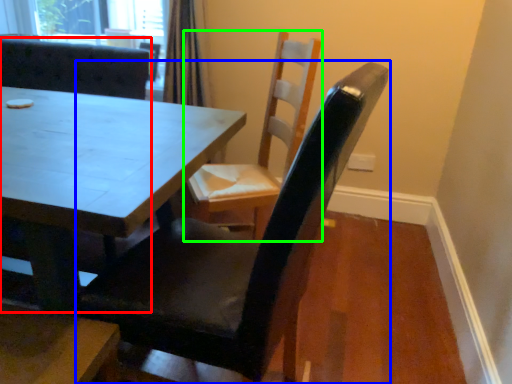
Question: Which object is the farthest from chair (highlighted by a red box)? Choose among these: chair (highlighted by a blue box) or chair (highlighted by a green box).

Choices:
 (A) chair
 (B) chair

Answer: (A)